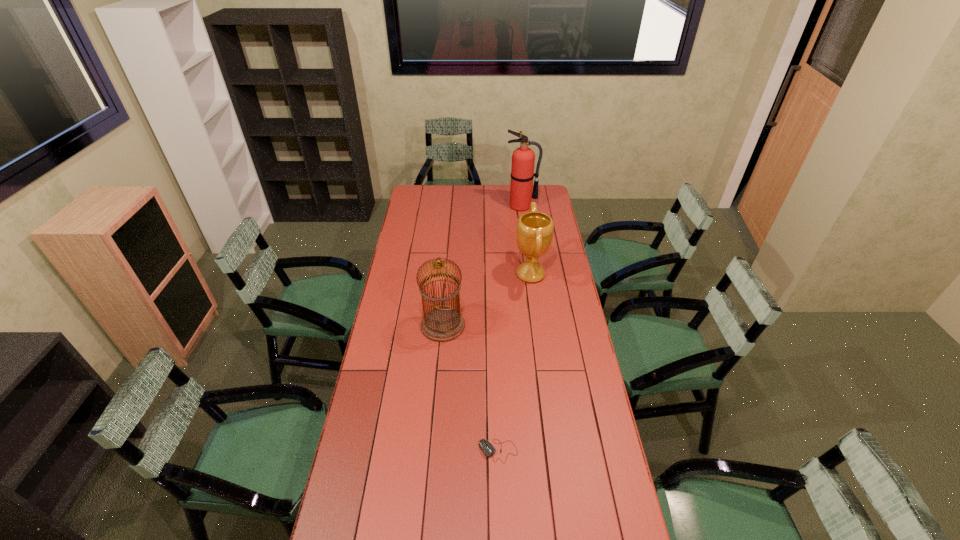
Where is `vacant point that satisfies the following two spatial constraints: 1. at the nozzle of the fire extinguisher; 2. on the front-facing side of the second nearest object`? vacant point that satisfies the following two spatial constraints: 1. at the nozzle of the fire extinguisher; 2. on the front-facing side of the second nearest object is located at coordinates (537, 326).

Image resolution: width=960 pixels, height=540 pixels. I want to click on free location that satisfies the following two spatial constraints: 1. at the nozzle of the farthest object; 2. on the front-facing side of the birdcage, so click(x=537, y=326).